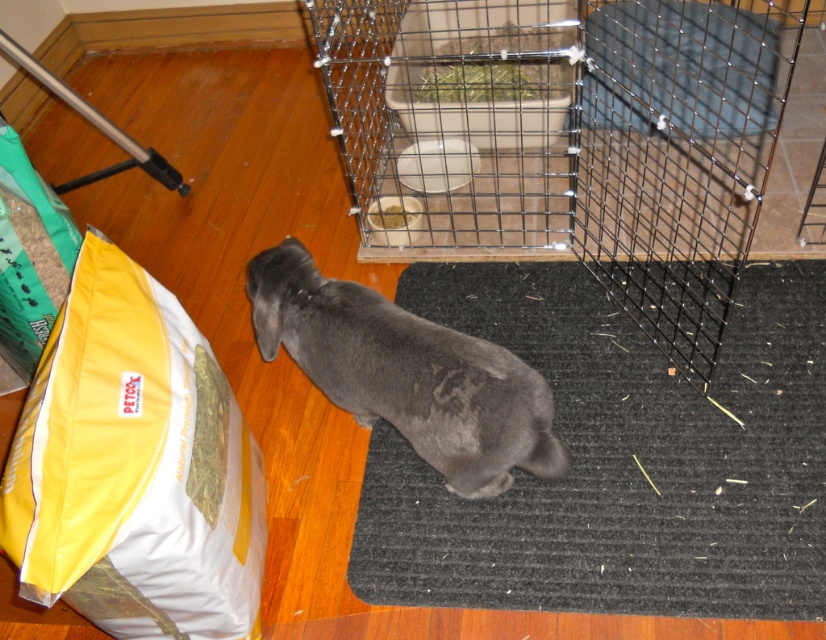
Question: Is black rubber mat at lower center positioned before green hay at upper center?

Choices:
 (A) yes
 (B) no

Answer: (A)

Question: Is smooth metal tray at upper center closer to camera compared to green hay at upper center?

Choices:
 (A) yes
 (B) no

Answer: (A)

Question: Can you confirm if black wire cage at center is positioned to the right of green hay at upper center?

Choices:
 (A) no
 (B) yes

Answer: (B)

Question: Which point appears closest to the camera in this image?

Choices:
 (A) (32, 291)
 (B) (347, 289)

Answer: (B)

Question: Which point is closer to the camera taking this photo?

Choices:
 (A) (521, 88)
 (B) (629, 92)

Answer: (B)

Question: Which of the following is the closest to the observer?

Choices:
 (A) brown textured hay at center
 (B) black rubber mat at lower center
 (C) green paper bag at left

Answer: (B)